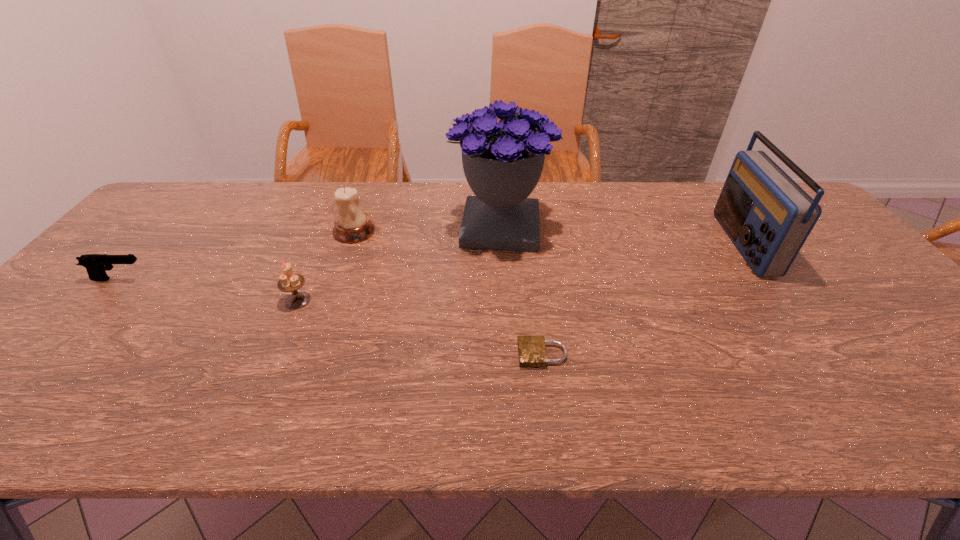
Find the location of `the tallest object`. the tallest object is located at coordinates (502, 161).

Find the location of a particular element. the second tallest object is located at coordinates (768, 216).

Where is `the rightmost object`? The image size is (960, 540). the rightmost object is located at coordinates (768, 216).

Where is `the taller candle holder`? the taller candle holder is located at coordinates (352, 225).

Identify the location of the third tallest object. This screenshot has width=960, height=540. (352, 225).

Where is `the nearer candle holder`? the nearer candle holder is located at coordinates (289, 282).

Find the location of `the fourth tallest object`. the fourth tallest object is located at coordinates (289, 282).

Find the location of `pistol`. pistol is located at coordinates (96, 265).

You are a GUI agent. You are given a task and a screenshot of the screen. Output one action in this format:
    pyautogui.click(x=<x>, y=<y>)
    Task: Click on the second shortest object
    Image resolution: width=960 pixels, height=540 pixels.
    Given the screenshot: What is the action you would take?
    pyautogui.click(x=96, y=265)

This screenshot has width=960, height=540. I want to click on the shortest object, so click(x=532, y=352).